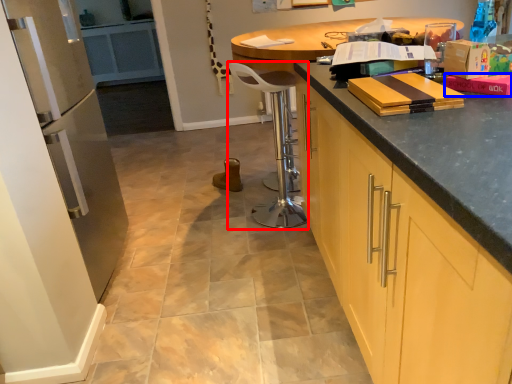
Question: Which object is further to the camera taking this photo, bar stool (highlighted by a red box) or book (highlighted by a blue box)?

Choices:
 (A) bar stool
 (B) book

Answer: (A)